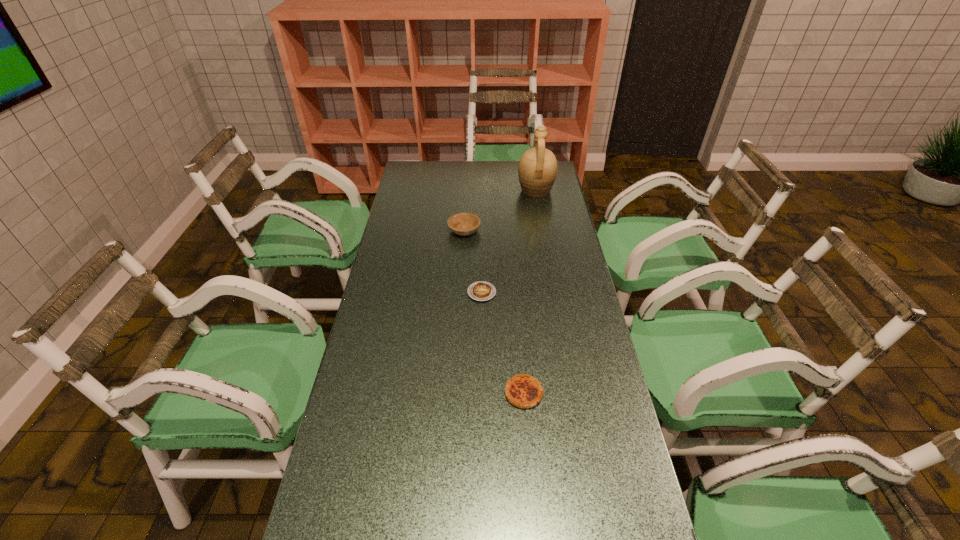
The image size is (960, 540). In order to click on free spot located 0.170m on the right of the nearer quiche in this screenshot , I will do `click(605, 393)`.

Where is `vacant area located on the left of the shorter quiche`? The image size is (960, 540). vacant area located on the left of the shorter quiche is located at coordinates (439, 293).

Where is `object present at the far edge`? The image size is (960, 540). object present at the far edge is located at coordinates (537, 170).

Find the location of a particular element. The width and height of the screenshot is (960, 540). object located at the right edge is located at coordinates (537, 170).

Find the location of a particular element. Image resolution: width=960 pixels, height=540 pixels. object that is at the far right corner is located at coordinates (537, 170).

I want to click on vacant region at the far edge, so click(514, 166).

At what (x,y) coordinates should I click in order to perform the action: click on vacant space at the left edge of the desktop. Please return your answer as a coordinate pair (x, y). This screenshot has height=540, width=960. Looking at the image, I should click on (369, 487).

In the image, there is a desktop. At what (x,y) coordinates should I click in order to perform the action: click on vacant space at the right edge. Please return your answer as a coordinate pair (x, y). This screenshot has height=540, width=960. Looking at the image, I should click on (591, 442).

Where is `vacant space at the far left corner of the desktop`? This screenshot has height=540, width=960. vacant space at the far left corner of the desktop is located at coordinates (409, 162).

You are a GUI agent. You are given a task and a screenshot of the screen. Output one action in this format:
    pyautogui.click(x=<x>, y=<y>)
    Task: Click on the free spot between the second tallest object and the tallest object
    The image size is (960, 540).
    Given the screenshot: What is the action you would take?
    pyautogui.click(x=500, y=211)